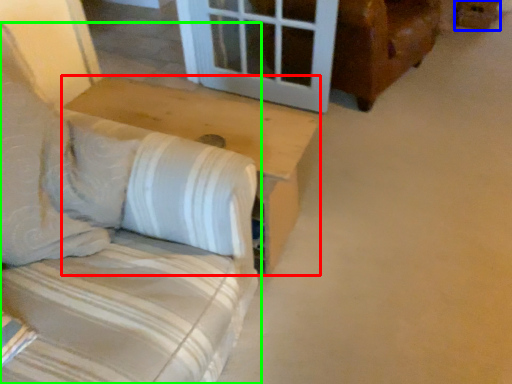
Question: Based on their relative distances, which object is nearer to table (highlighted by a red box)? Choose from cardboard box (highlighted by a blue box) and furniture (highlighted by a green box).

Choices:
 (A) cardboard box
 (B) furniture

Answer: (B)